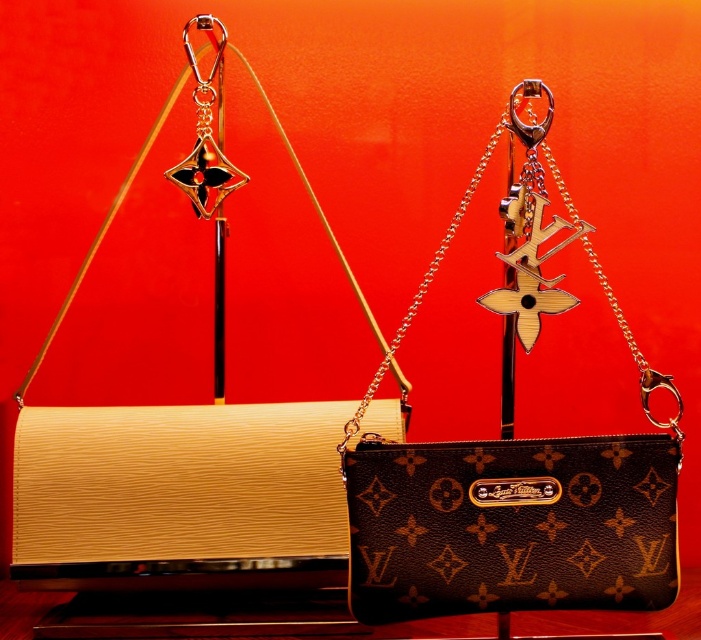
You are a photographer adjusting your camera to focus on two points in the image. The first point is point (x=416, y=612) and the second is point (x=193, y=204). Which point should you focus on first to ensure the closest object is sharp?

Point (x=416, y=612) is closer to the camera than point (x=193, y=204), so you should focus on point (x=416, y=612) first to ensure the closest object is sharp.

You are a store employee arranging items in the display. You need to place a new decorative hook behind the brown monogrammed leather handbag at center so it can hold a tag. Is the metallic gold hook at upper center currently positioned in a suitable location to serve this purpose?

The metallic gold hook at upper center is behind the brown monogrammed leather handbag at center, so it is already positioned in a suitable location to hold a tag behind the handbag.